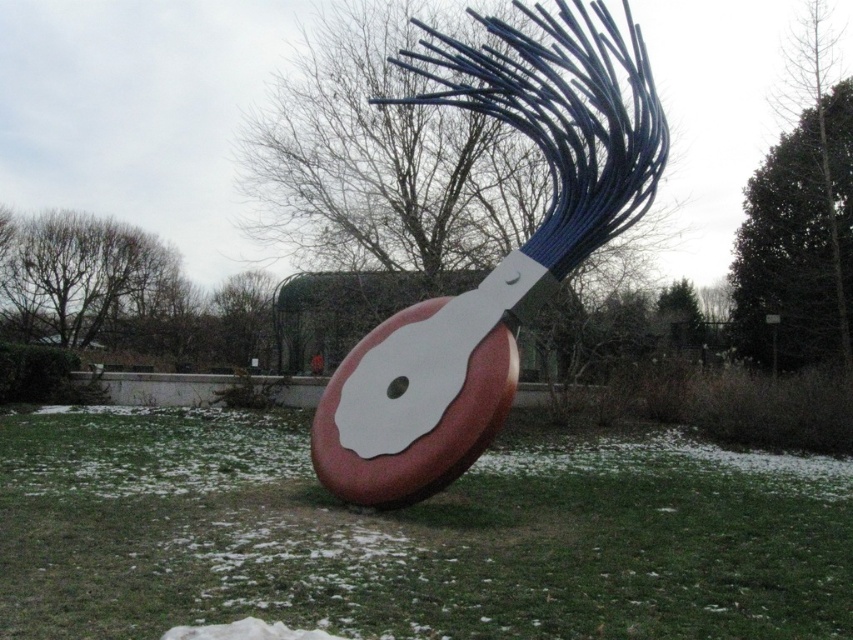
Does green grass at center lie in front of matte red and white sculpture at center?

That is True.

Is green grass at center shorter than matte red and white sculpture at center?

No.

Which is in front, point (223, 541) or point (570, 164)?

Positioned in front is point (223, 541).

You are a GUI agent. You are given a task and a screenshot of the screen. Output one action in this format:
    pyautogui.click(x=<x>, y=<y>)
    Task: Click on the green grass at center
    This screenshot has height=640, width=853.
    Given the screenshot: What is the action you would take?
    (x=412, y=538)